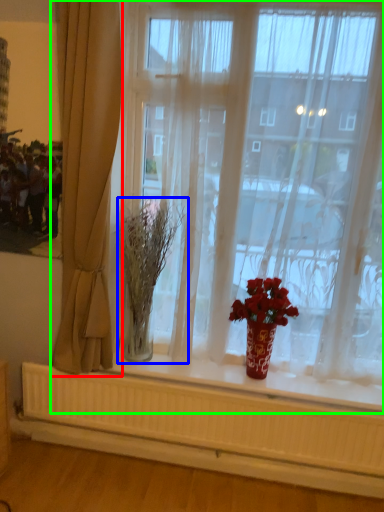
Question: Which object is the farthest from curtain (highlighted by a red box)? Choose among these: plant (highlighted by a blue box) or window (highlighted by a green box).

Choices:
 (A) plant
 (B) window

Answer: (B)